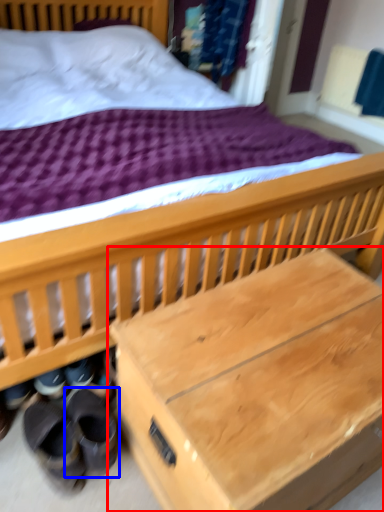
Question: Among these objects, which one is farthest to the camera, table (highlighted by a red box) or footwear (highlighted by a blue box)?

Choices:
 (A) table
 (B) footwear

Answer: (B)